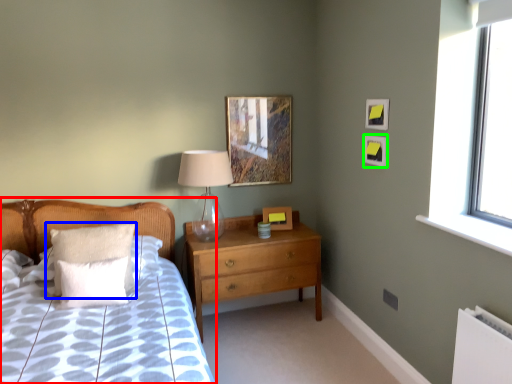
Question: Considering the real-world distances, which object is closest to bed (highlighted by a red box)? pillow (highlighted by a blue box) or picture frame (highlighted by a green box).

Choices:
 (A) pillow
 (B) picture frame

Answer: (A)